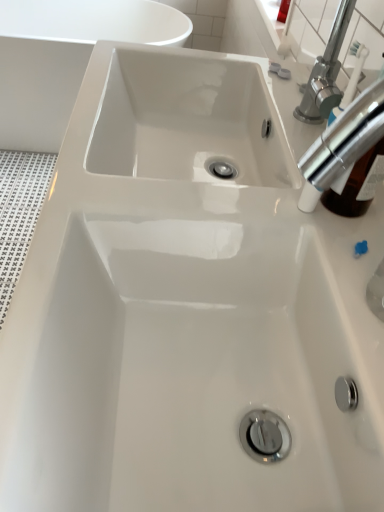
Where is `vacant area situated to the left side of chrome metallic tap at upper right`? This screenshot has height=512, width=384. vacant area situated to the left side of chrome metallic tap at upper right is located at coordinates tap(231, 213).